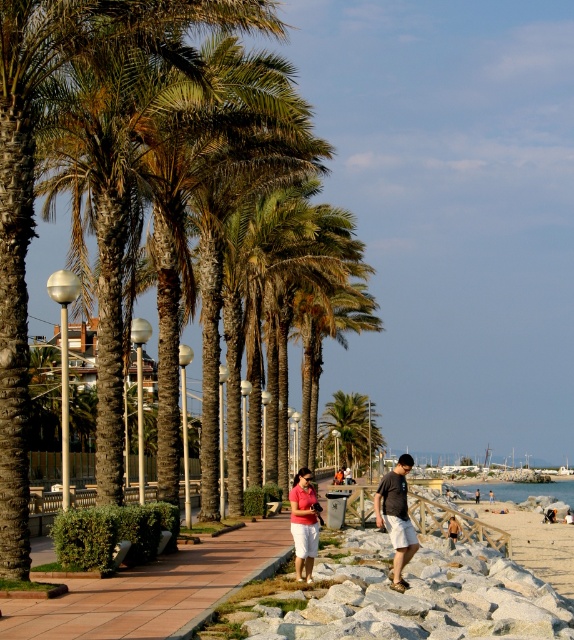
Question: Based on their relative distances, which object is farther from the green leafy palm tree at center?

Choices:
 (A) beige fabric shorts at center
 (B) orange fabric shirt at center
 (C) matte pink shirt at center

Answer: (C)

Question: Is green leafy palm tree at center above dark gray t-shirt at center?

Choices:
 (A) yes
 (B) no

Answer: (B)

Question: Which point is closer to the camera?

Choices:
 (A) dark gray t-shirt at center
 (B) beige fabric shorts at center

Answer: (A)

Question: Does green leafy palm tree at center have a greater width compared to dark gray t-shirt at center?

Choices:
 (A) yes
 (B) no

Answer: (A)

Question: Which of the following is the farthest from the observer?

Choices:
 (A) orange fabric shirt at center
 (B) dark gray t-shirt at center
 (C) matte pink shirt at center

Answer: (A)

Question: Is matte pink shirt at center thinner than orange fabric shirt at center?

Choices:
 (A) yes
 (B) no

Answer: (A)